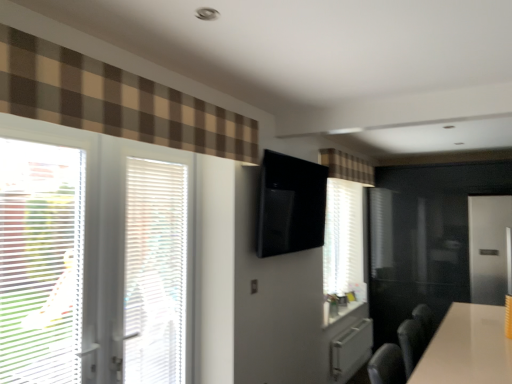
Question: Which direction should I rotate to look at brown plaid curtain at upper center, placed as the 2th curtain when sorted from left to right?

Choices:
 (A) right
 (B) left

Answer: (A)

Question: Is white plastic blinds at left, which appears as the first window when viewed from the left, in front of white textured blinds at left, acting as the first window starting from the right?

Choices:
 (A) yes
 (B) no

Answer: (B)

Question: Is white plastic blinds at left, marked as the second window in a right-to-left arrangement, further to the viewer compared to white textured blinds at left, which is counted as the second window, starting from the left?

Choices:
 (A) yes
 (B) no

Answer: (A)

Question: Is white textured blinds at left, which is counted as the second window, starting from the left, inside white plastic blinds at left, which appears as the first window when viewed from the left?

Choices:
 (A) no
 (B) yes

Answer: (A)

Question: Is white plastic blinds at left, which appears as the first window when viewed from the left, far from white textured blinds at left, which is counted as the second window, starting from the left?

Choices:
 (A) yes
 (B) no

Answer: (B)

Question: Is white plastic blinds at left, which appears as the first window when viewed from the left, with white textured blinds at left, which is counted as the second window, starting from the left?

Choices:
 (A) no
 (B) yes

Answer: (A)

Question: Can you confirm if white plastic blinds at left, which appears as the first window when viewed from the left, is taller than white textured blinds at left, acting as the first window starting from the right?

Choices:
 (A) yes
 (B) no

Answer: (B)

Question: Can you confirm if satin silver screen door at right is shorter than white plastic blinds at left, marked as the second window in a right-to-left arrangement?

Choices:
 (A) yes
 (B) no

Answer: (B)

Question: Is there a large distance between satin silver screen door at right and white plastic blinds at left, which appears as the first window when viewed from the left?

Choices:
 (A) no
 (B) yes

Answer: (B)

Question: Does satin silver screen door at right have a larger size compared to white plastic blinds at left, marked as the second window in a right-to-left arrangement?

Choices:
 (A) no
 (B) yes

Answer: (B)

Question: Is satin silver screen door at right in front of white plastic blinds at left, which appears as the first window when viewed from the left?

Choices:
 (A) no
 (B) yes

Answer: (A)

Question: Does satin silver screen door at right have a greater height compared to white plastic blinds at left, marked as the second window in a right-to-left arrangement?

Choices:
 (A) yes
 (B) no

Answer: (A)

Question: Is satin silver screen door at right to the right of white plastic blinds at left, marked as the second window in a right-to-left arrangement, from the viewer's perspective?

Choices:
 (A) no
 (B) yes

Answer: (B)

Question: Is brown checkered curtain at upper left, which is the 1th curtain in front-to-back order, wider than white plastic blinds at left?

Choices:
 (A) no
 (B) yes

Answer: (B)